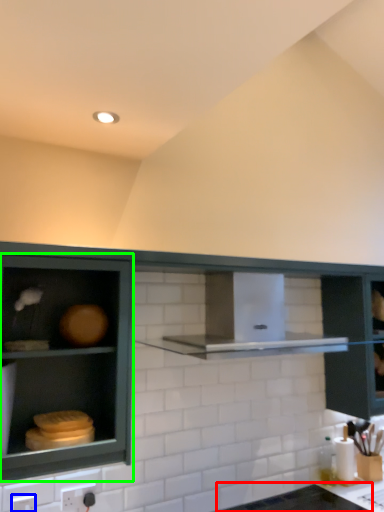
Question: Based on their relative distances, which object is farther from counter top (highlighted by a red box)? Choose from electric outlet (highlighted by a blue box) and cabinetry (highlighted by a green box).

Choices:
 (A) electric outlet
 (B) cabinetry

Answer: (A)